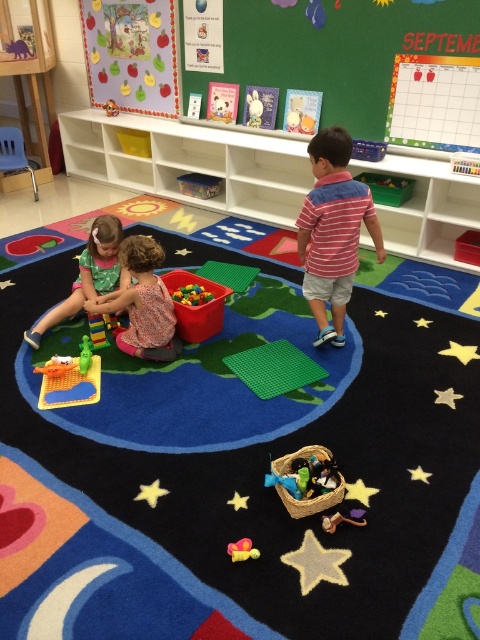
I want to click on green fabric dress at lower left, so click(90, 275).

This screenshot has width=480, height=640. I want to click on green fabric dress at lower left, so click(x=90, y=275).

Which is in front, point (410, 74) or point (259, 120)?

Point (410, 74)

Does green matte calendar at upper right appear on the left side of white plush rabbit at upper center?

No, green matte calendar at upper right is not to the left of white plush rabbit at upper center.

Between point (435, 116) and point (259, 113), which one is positioned behind?

The point (259, 113) is more distant.

You are a GUI agent. You are given a task and a screenshot of the screen. Output one action in this format:
    pyautogui.click(x=<x>, y=<y>)
    Task: Click on the green matte calendar at upper right
    
    Given the screenshot: What is the action you would take?
    pyautogui.click(x=434, y=102)

Which is above, green matte calendar at upper right or green plastic toy at lower left?

green matte calendar at upper right is higher up.

Is green matte calendar at upper right to the right of green plastic toy at lower left from the viewer's perspective?

Indeed, green matte calendar at upper right is positioned on the right side of green plastic toy at lower left.

The width and height of the screenshot is (480, 640). Identify the location of green matte calendar at upper right. (434, 102).